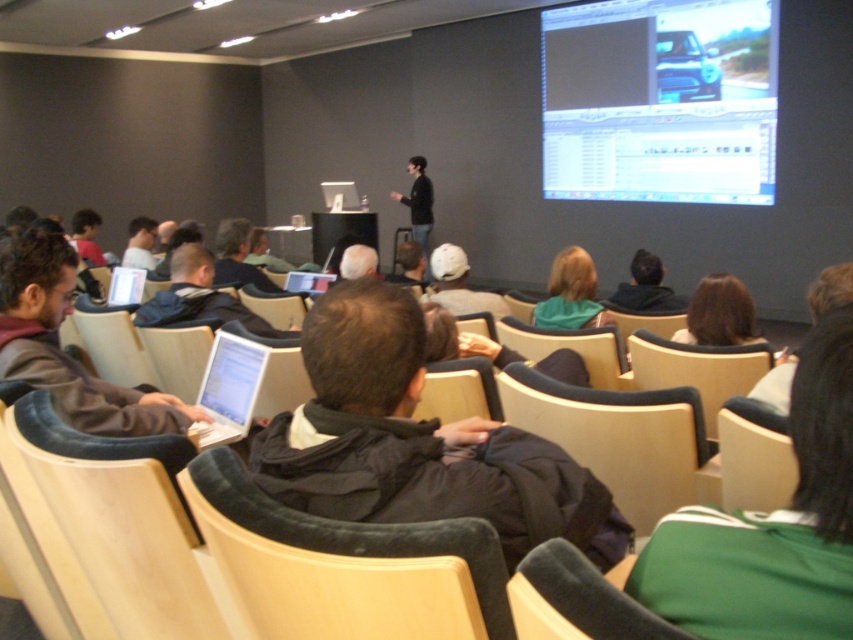
Is light wood chair at lower right to the left of dark blue jacket at center from the viewer's perspective?

Incorrect, light wood chair at lower right is not on the left side of dark blue jacket at center.

Is point (764, 451) farther from viewer compared to point (254, 328)?

No, (764, 451) is in front of (254, 328).

Who is more distant from viewer, (728, 428) or (215, 323)?

Positioned behind is point (215, 323).

You are a GUI agent. You are given a task and a screenshot of the screen. Output one action in this format:
    pyautogui.click(x=<x>, y=<y>)
    Task: Click on the light wood chair at lower right
    
    Given the screenshot: What is the action you would take?
    pyautogui.click(x=753, y=465)

From the picture: Can you confirm if light wood/soft fabric chair at lower left is taller than dark blue jacket at center?

Yes, light wood/soft fabric chair at lower left is taller than dark blue jacket at center.

Can you confirm if light wood/soft fabric chair at lower left is positioned above dark blue jacket at center?

Incorrect, light wood/soft fabric chair at lower left is not positioned above dark blue jacket at center.

Is point (195, 534) positioned before point (215, 307)?

Yes, point (195, 534) is closer to viewer.

Image resolution: width=853 pixels, height=640 pixels. I want to click on light wood/soft fabric chair at lower left, so click(x=126, y=540).

Which is in front, point (689, 8) or point (178, 618)?

Point (178, 618)

This screenshot has height=640, width=853. What do you see at coordinates (660, 100) in the screenshot?
I see `matte black car at upper center` at bounding box center [660, 100].

Locate an element on the screen. matte black car at upper center is located at coordinates (660, 100).